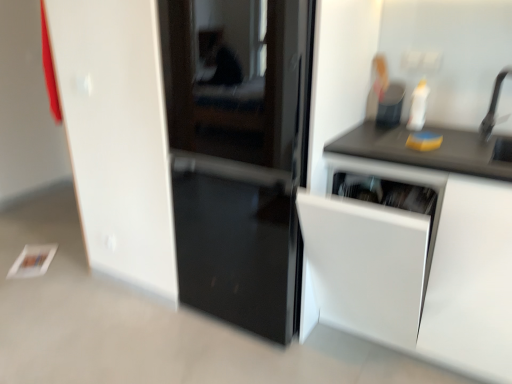
Question: Is black matte faucet at upper right not within matte black container at upper right?

Choices:
 (A) no
 (B) yes

Answer: (B)

Question: Considering the relative positions of black matte faucet at upper right and matte black container at upper right in the image provided, is black matte faucet at upper right to the left of matte black container at upper right from the viewer's perspective?

Choices:
 (A) yes
 (B) no

Answer: (B)

Question: From a real-world perspective, is black matte faucet at upper right positioned over matte black container at upper right based on gravity?

Choices:
 (A) yes
 (B) no

Answer: (A)

Question: Is black matte faucet at upper right bigger than matte black container at upper right?

Choices:
 (A) yes
 (B) no

Answer: (A)

Question: Considering the relative sizes of black matte faucet at upper right and matte black container at upper right in the image provided, is black matte faucet at upper right thinner than matte black container at upper right?

Choices:
 (A) yes
 (B) no

Answer: (B)

Question: Is the depth of black matte faucet at upper right greater than that of matte black container at upper right?

Choices:
 (A) no
 (B) yes

Answer: (A)

Question: Would you say matte black container at upper right contains black matte countertop at upper right?

Choices:
 (A) no
 (B) yes

Answer: (A)

Question: Is matte black container at upper right outside black matte countertop at upper right?

Choices:
 (A) no
 (B) yes

Answer: (B)

Question: From the image's perspective, is matte black container at upper right below black matte countertop at upper right?

Choices:
 (A) yes
 (B) no

Answer: (B)

Question: From a real-world perspective, is matte black container at upper right over black matte countertop at upper right?

Choices:
 (A) no
 (B) yes

Answer: (B)

Question: Is the position of matte black container at upper right more distant than that of black matte countertop at upper right?

Choices:
 (A) yes
 (B) no

Answer: (A)

Question: Considering the relative sizes of matte black container at upper right and black matte countertop at upper right in the image provided, is matte black container at upper right wider than black matte countertop at upper right?

Choices:
 (A) yes
 (B) no

Answer: (B)

Question: From a real-world perspective, does glossy black door at center stand above black matte faucet at upper right?

Choices:
 (A) yes
 (B) no

Answer: (B)